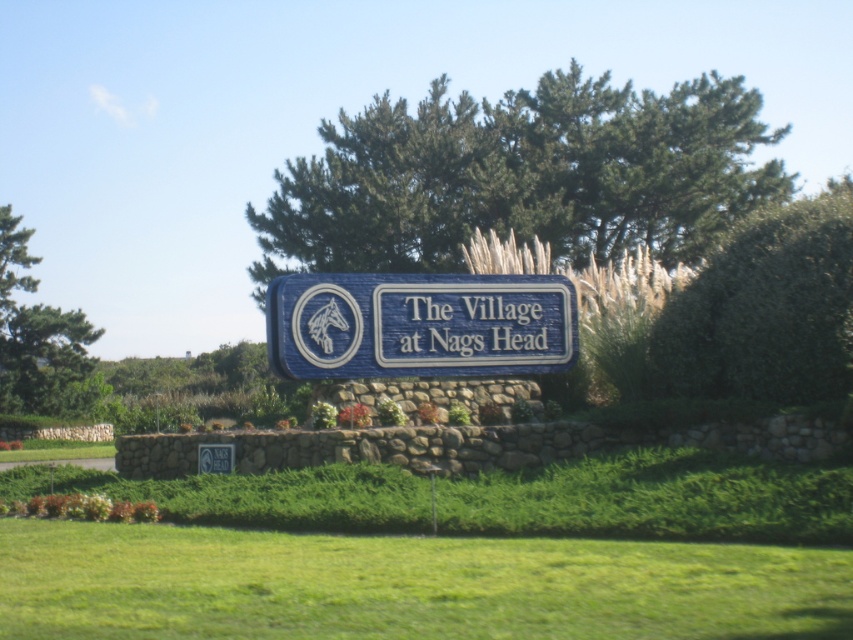
You are standing in front of the signboard for The Village at Nags Head. You want to take a photo of the green leafy tree at center while ensuring the entire signboard is visible in the frame. Given that your camera has a maximum focal length of 50mm, can you determine if you need to move closer or farther away from the signboard to include both the tree and the sign in the shot?

The green leafy tree at center is 206.52 feet away from camera. Since the tree is quite far away, you would need to use a wider focal length to capture both the signboard and the tree in the same frame. However, your camera has a maximum focal length of 50mm, which is relatively wide. Therefore, you should be able to capture both the signboard and the green leafy tree at center without needing to move closer or farther away, provided the camera is positioned appropriately.

You are standing at the entrance of The Village at Nags Head and want to locate the green leafy tree at center. According to the map coordinates, where should you look to find it?

The green leafy tree at center is located at coordinates point (521, 176).